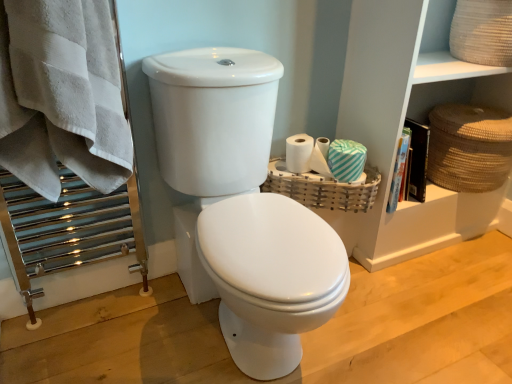
Question: From the image's perspective, is white matte toilet paper at center, which is the first toilet paper from left to right, above woven wood basket at right, the second basket in the right-to-left sequence?

Choices:
 (A) yes
 (B) no

Answer: (A)

Question: Is white matte toilet paper at center, which is the first toilet paper from left to right, to the left of woven wood basket at right, the second basket in the right-to-left sequence, from the viewer's perspective?

Choices:
 (A) no
 (B) yes

Answer: (B)

Question: Can you confirm if white matte toilet paper at center, the 2th toilet paper in the right-to-left sequence, is thinner than woven wood basket at right, arranged as the 1th basket when viewed from the left?

Choices:
 (A) yes
 (B) no

Answer: (A)

Question: Is the position of white matte toilet paper at center, which is the first toilet paper from left to right, more distant than that of woven wood basket at right, the second basket in the right-to-left sequence?

Choices:
 (A) no
 (B) yes

Answer: (B)

Question: Does white matte toilet paper at center, the 2th toilet paper in the right-to-left sequence, have a lesser height compared to woven wood basket at right, arranged as the 1th basket when viewed from the left?

Choices:
 (A) no
 (B) yes

Answer: (A)

Question: Is white matte toilet paper at center, the 2th toilet paper in the right-to-left sequence, facing towards woven wood basket at right, arranged as the 1th basket when viewed from the left?

Choices:
 (A) yes
 (B) no

Answer: (B)

Question: Is brown woven basket at right, the 1th basket viewed from the right, outside white glossy toilet at center?

Choices:
 (A) yes
 (B) no

Answer: (A)

Question: Is brown woven basket at right, the second basket when ordered from left to right, smaller than white glossy toilet at center?

Choices:
 (A) no
 (B) yes

Answer: (B)

Question: From a real-world perspective, is brown woven basket at right, the 1th basket viewed from the right, physically above white glossy toilet at center?

Choices:
 (A) no
 (B) yes

Answer: (A)

Question: Does brown woven basket at right, the second basket when ordered from left to right, have a greater width compared to white glossy toilet at center?

Choices:
 (A) no
 (B) yes

Answer: (A)

Question: Is brown woven basket at right, the second basket when ordered from left to right, in contact with white glossy toilet at center?

Choices:
 (A) yes
 (B) no

Answer: (B)

Question: Is brown woven basket at right, the 1th basket viewed from the right, positioned before white glossy toilet at center?

Choices:
 (A) yes
 (B) no

Answer: (B)

Question: Is white glossy toilet at center wider than teal striped toilet paper at right, which is counted as the second toilet paper, starting from the left?

Choices:
 (A) no
 (B) yes

Answer: (B)